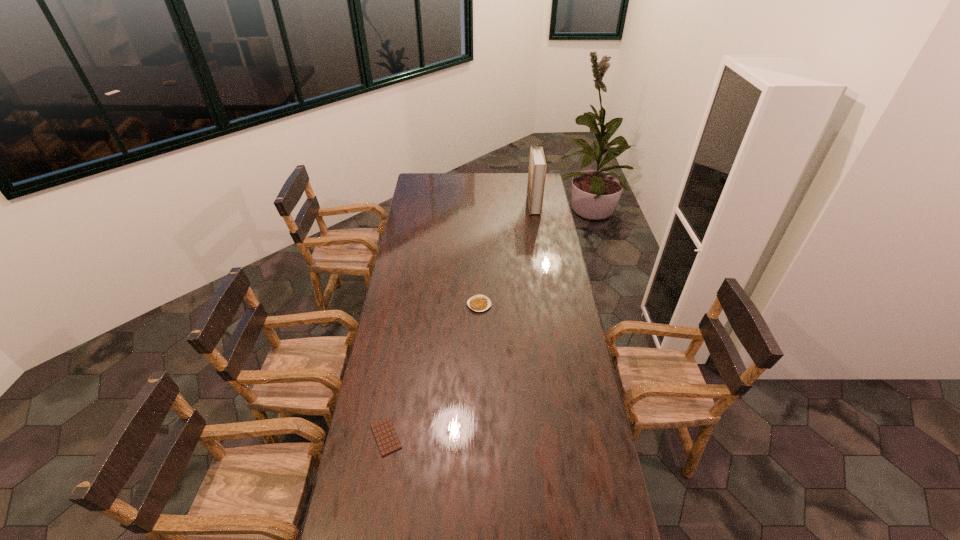
The height and width of the screenshot is (540, 960). Identify the location of the tallest object. (537, 164).

Identify the location of phonebook. This screenshot has width=960, height=540. (537, 164).

Find the location of a particular element. legume is located at coordinates (479, 303).

The width and height of the screenshot is (960, 540). Find the location of `the second object from left to right`. the second object from left to right is located at coordinates (479, 303).

I want to click on the shortest object, so click(387, 440).

This screenshot has height=540, width=960. In order to click on the nearest object in this screenshot , I will do `click(387, 440)`.

Locate an element on the screen. free point located on the cover of the tallest object is located at coordinates (475, 206).

At what (x,y) coordinates should I click in order to perform the action: click on vacant region located on the cover of the tallest object. Please return your answer as a coordinate pair (x, y). The height and width of the screenshot is (540, 960). Looking at the image, I should click on (506, 206).

You are a GUI agent. You are given a task and a screenshot of the screen. Output one action in this format:
    pyautogui.click(x=<x>, y=<y>)
    Task: Click on the free region located on the cover of the tallest object
    The width and height of the screenshot is (960, 540).
    Given the screenshot: What is the action you would take?
    pyautogui.click(x=467, y=206)

The width and height of the screenshot is (960, 540). Identify the location of blank area located 0.390m on the back of the second farthest object. (479, 246).